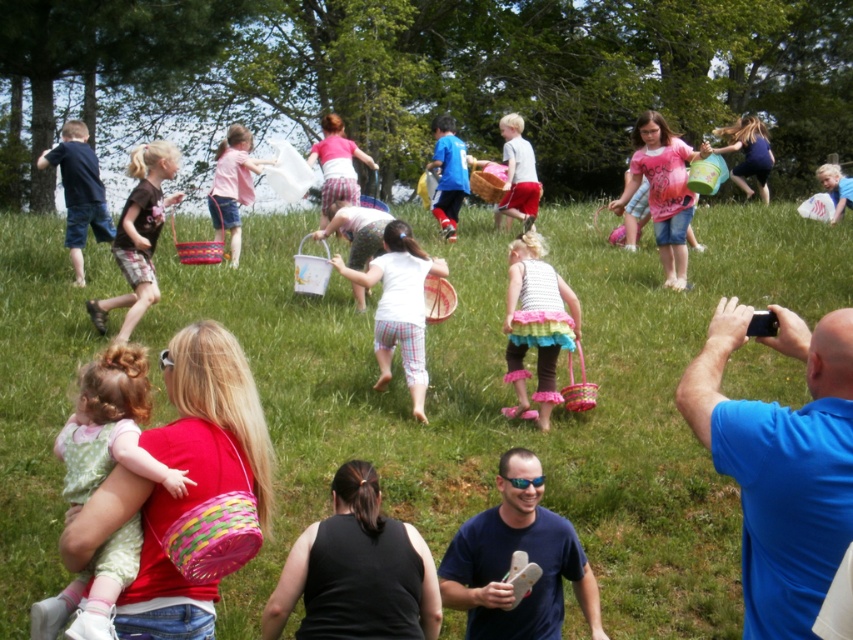
Question: Is polka dot fabric baby at center closer to the viewer compared to crochet dress at center?

Choices:
 (A) no
 (B) yes

Answer: (B)

Question: Is green grassy field at center smaller than polka dot fabric baby at center?

Choices:
 (A) no
 (B) yes

Answer: (A)

Question: Estimate the real-world distances between objects in this image. Which object is closer to the green grassy field at center?

Choices:
 (A) matte blue dress at upper right
 (B) pink fabric basket at center
 (C) white cotton dress at center

Answer: (C)

Question: Estimate the real-world distances between objects in this image. Which object is closer to the matte blue dress at upper right?

Choices:
 (A) matte pink shorts at center
 (B) blonde hair at upper right

Answer: (B)

Question: Does crochet dress at center appear over white cotton dress at center?

Choices:
 (A) no
 (B) yes

Answer: (A)

Question: Which point is closer to the camera?

Choices:
 (A) green grassy field at center
 (B) matte blue dress at upper right
 (C) dark brown t-shirt at center

Answer: (A)